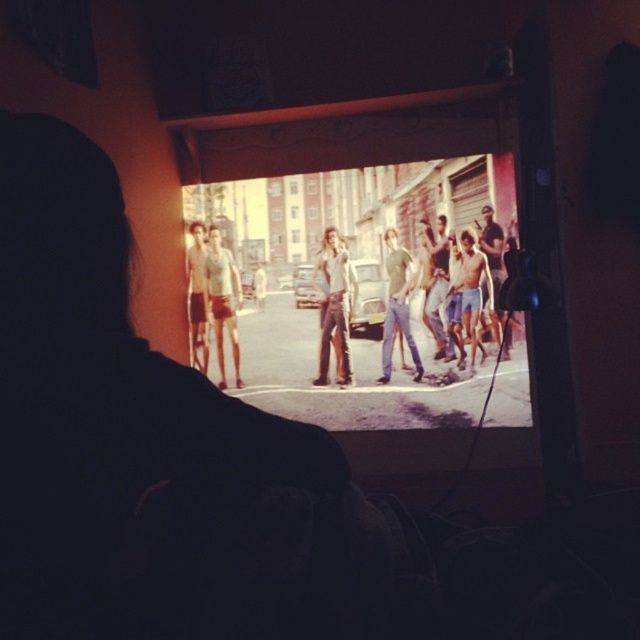
What do you see at coordinates (349, 291) in the screenshot? This screenshot has height=640, width=640. I see `vivid yellow street at center` at bounding box center [349, 291].

Measure the distance between vivid yellow street at center and camera.

vivid yellow street at center and camera are 3.12 meters apart.

You are a GUI agent. You are given a task and a screenshot of the screen. Output one action in this format:
    pyautogui.click(x=<x>, y=<y>)
    Task: Click on the vivid yellow street at center
    Image resolution: width=640 pixels, height=640 pixels.
    Given the screenshot: What is the action you would take?
    pyautogui.click(x=349, y=291)

This screenshot has width=640, height=640. What are the coordinates of `vivid yellow street at center` in the screenshot? It's located at (349, 291).

In the scene shown: Is smooth beige shorts at center below shiny metallic shirt at center?

Correct, smooth beige shorts at center is located below shiny metallic shirt at center.

Who is shorter, smooth beige shorts at center or shiny metallic shirt at center?

shiny metallic shirt at center is shorter.

Locate an element on the screen. This screenshot has height=640, width=640. smooth beige shorts at center is located at coordinates (221, 300).

Find the location of a particular element. smooth beige shorts at center is located at coordinates (221, 300).

The image size is (640, 640). What do you see at coordinates (333, 308) in the screenshot?
I see `denim pants at center` at bounding box center [333, 308].

Where is `denim pants at center`? This screenshot has height=640, width=640. denim pants at center is located at coordinates (333, 308).

Find the location of a particular element. The height and width of the screenshot is (640, 640). denim pants at center is located at coordinates (333, 308).